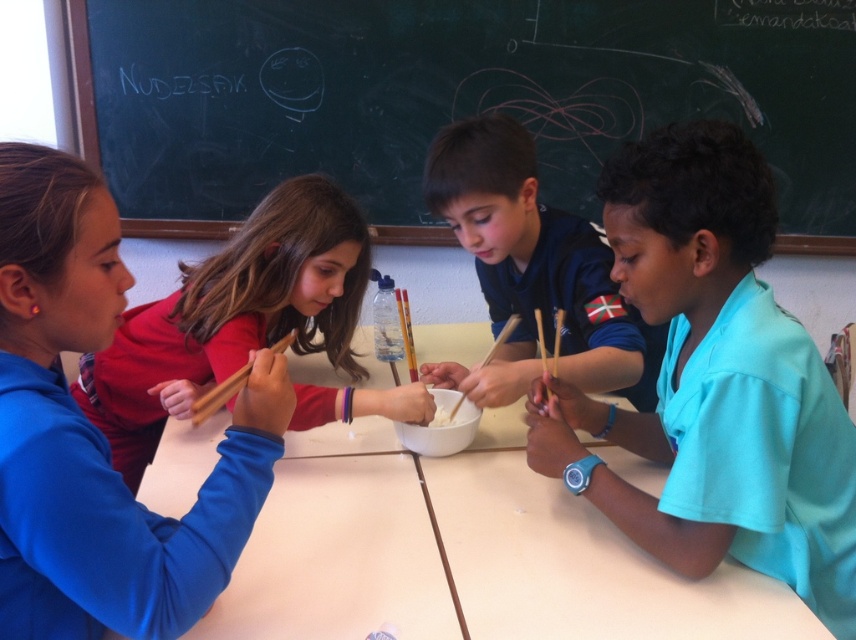
Question: Which of the following is the farthest from the observer?

Choices:
 (A) teal smooth shirt at right
 (B) wooden chopstick at center

Answer: (B)

Question: Among these points, which one is nearest to the camera?

Choices:
 (A) (117, 353)
 (B) (507, 339)
 (C) (556, 344)
 (D) (194, 408)

Answer: (D)

Question: Is matte red shirt at upper left behind wooden chopsticks at upper center?

Choices:
 (A) yes
 (B) no

Answer: (A)

Question: Is teal smooth shirt at right further to the viewer compared to wooden chopsticks at upper center?

Choices:
 (A) no
 (B) yes

Answer: (B)

Question: Where is white matte table at center located in relation to white matte bowl at center in the image?

Choices:
 (A) below
 (B) above

Answer: (A)

Question: Which of the following is the farthest from the observer?

Choices:
 (A) (183, 310)
 (B) (557, 340)
 (C) (484, 381)

Answer: (A)